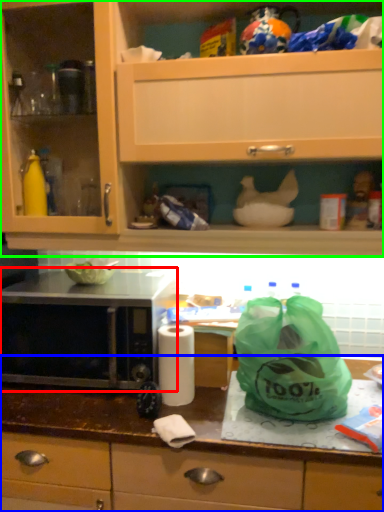
Question: Which object is positioned closest to microwave oven (highlighted by a red box)? Select from countertop (highlighted by a blue box) and cabinetry (highlighted by a green box).

Choices:
 (A) countertop
 (B) cabinetry

Answer: (A)